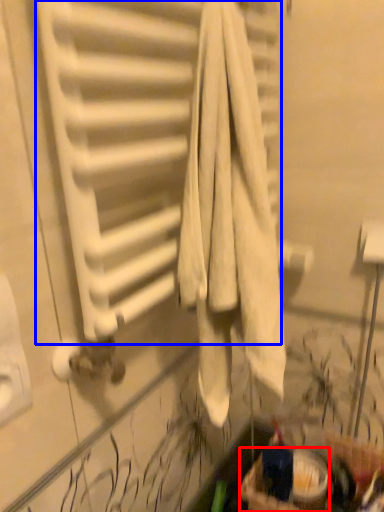
Question: Which point is further to the camera, basket (highlighted by a red box) or radiator (highlighted by a blue box)?

Choices:
 (A) basket
 (B) radiator

Answer: (A)